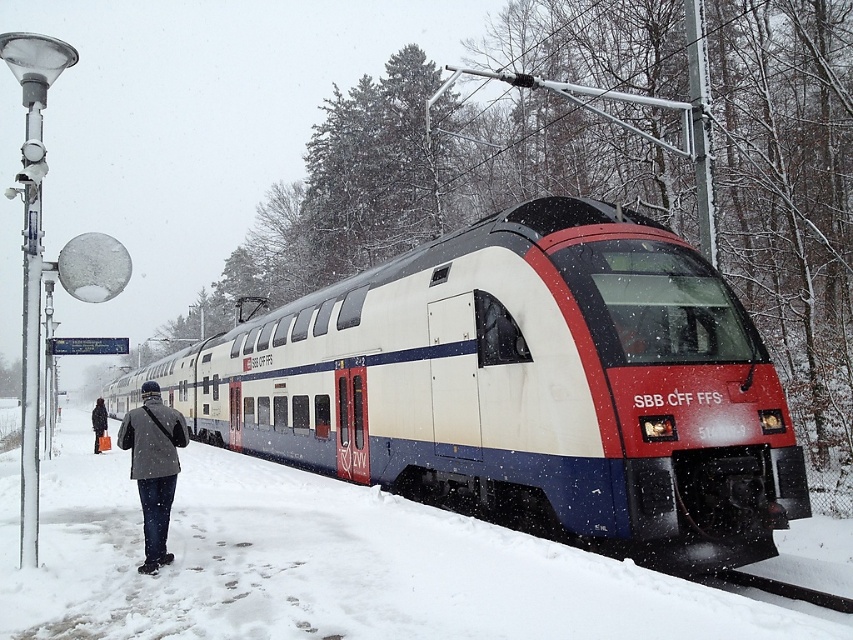
You are standing on the snowy platform and see the white glossy train at center and the dark gray wool coat at left. Which object is positioned more to the right side of the platform?

The white glossy train at center is positioned more to the right side of the platform than the dark gray wool coat at left.

You are a photographer standing on the snowy platform. You want to capture a photo of the white glossy train at center and the dark gray wool coat at left in the same frame. Given the spatial relationship between them, can you fit both subjects into the photo without zooming in?

The white glossy train at center is wider than the dark gray wool coat at left, so yes, both subjects can be captured in the same frame without zooming in as the train provides sufficient width to include the coat as well.

You are a photographer standing on the snowy platform. You want to take a photo of the white glossy train at center and the dark gray wool coat at left. Which object should you zoom in on to capture both subjects in the frame without moving your position?

The white glossy train at center is taller than the dark gray wool coat at left, so you should zoom in on the white glossy train at center to ensure both subjects fit within the frame.